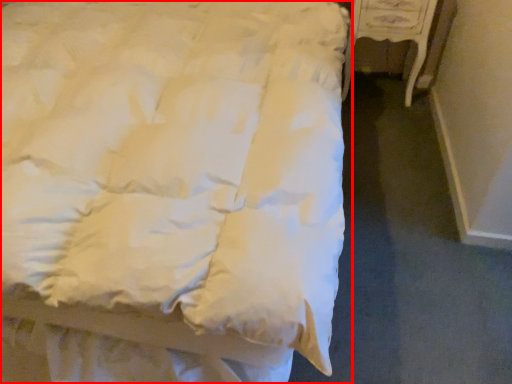
Question: From the image, what is the correct spatial relationship of bed (annotated by the red box) in relation to furniture?

Choices:
 (A) right
 (B) left

Answer: (B)